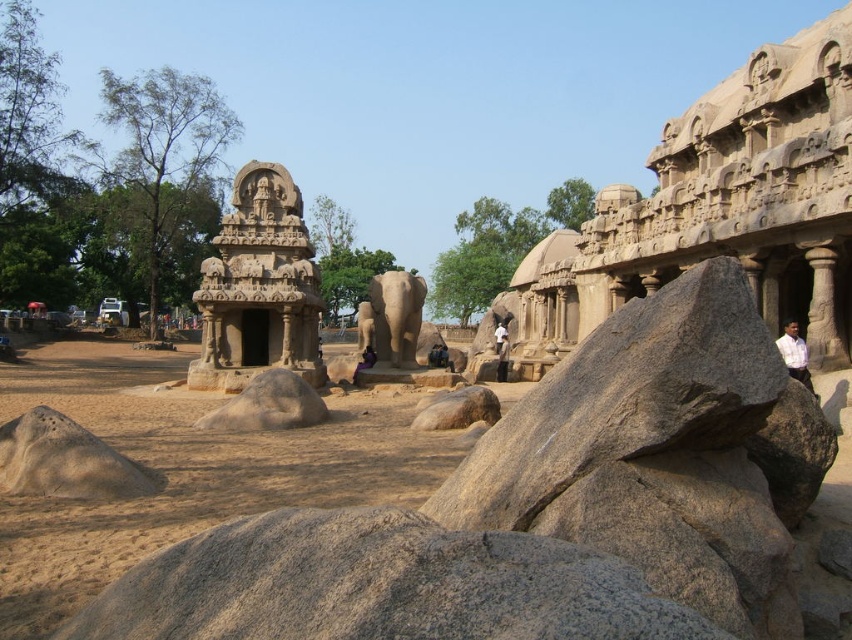
Question: Which of the following is the farthest from the observer?

Choices:
 (A) dark brown stone statue at center
 (B) purple fabric at center
 (C) brown stone statue at center

Answer: (A)

Question: Among these objects, which one is farthest from the camera?

Choices:
 (A) dark brown stone statue at center
 (B) white shirt at center

Answer: (A)

Question: Which object appears closest to the camera in this image?

Choices:
 (A) white shirt at right
 (B) gray stone elephant at center

Answer: (A)

Question: In this image, where is white shirt at center located relative to purple fabric at center?

Choices:
 (A) below
 (B) above

Answer: (B)

Question: Is brown stone statue at center behind purple fabric at center?

Choices:
 (A) no
 (B) yes

Answer: (A)

Question: Is white shirt at center further to camera compared to dark brown stone statue at center?

Choices:
 (A) no
 (B) yes

Answer: (A)